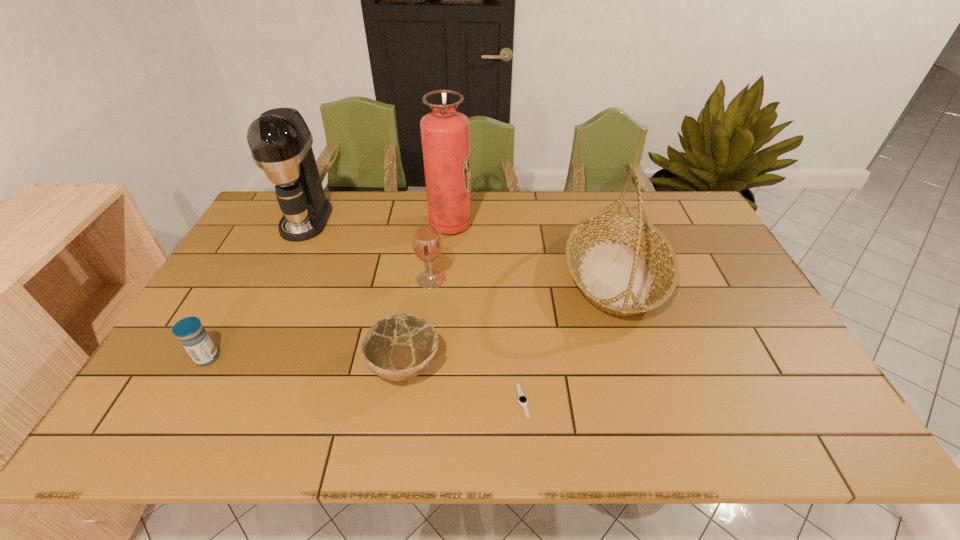
Find the location of a particular element. The image size is (960, 540). free spot between the fifth tallest object and the wineglass is located at coordinates (320, 318).

You are a GUI agent. You are given a task and a screenshot of the screen. Output one action in this format:
    pyautogui.click(x=<x>, y=<y>)
    Task: Click on the vacant region between the fire extinguisher and the coffee maker
    This screenshot has width=960, height=540.
    Given the screenshot: What is the action you would take?
    pyautogui.click(x=378, y=222)

Locate an element on the screen. free space between the fire extinguisher and the sixth tallest object is located at coordinates (427, 295).

Image resolution: width=960 pixels, height=540 pixels. What are the coordinates of `vacant space that is in between the fifth shortest object and the watch` in the screenshot? It's located at (569, 338).

I want to click on vacant space that is in between the fire extinguisher and the bowl, so click(427, 295).

At what (x,y) coordinates should I click in order to perform the action: click on free space that is in between the shortest object and the third shortest object. Please return your answer as a coordinate pair (x, y). Looking at the image, I should click on (365, 379).

This screenshot has height=540, width=960. Identify the location of object that is the second closest to the coffee maker. (427, 241).

Locate which object is the third closest to the fourth shortest object. Please provide its 2D coordinates. Your answer should be formatted as a tuple, i.e. [(x, y)], where the tuple contains the x and y coordinates of a point satisfying the conditions above.

[(622, 264)]

Where is `free region that satisfies the following two spatial constraints: 1. place cup under the spout of the coffee maker; 2. on the left side of the second shortest object`? free region that satisfies the following two spatial constraints: 1. place cup under the spout of the coffee maker; 2. on the left side of the second shortest object is located at coordinates (235, 366).

I want to click on free space in the image that satisfies the following two spatial constraints: 1. on the label side of the fire extinguisher; 2. on the back side of the fifth shortest object, so click(446, 274).